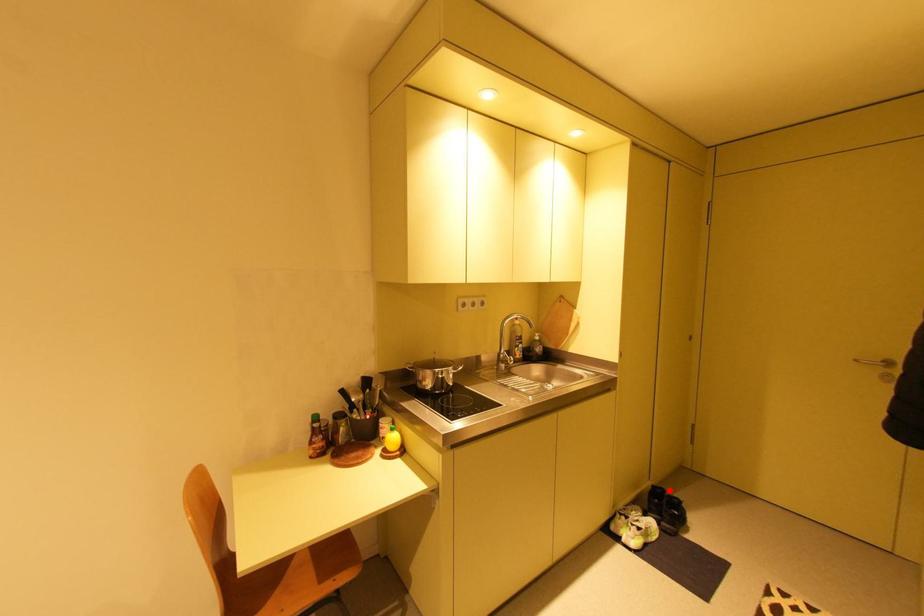
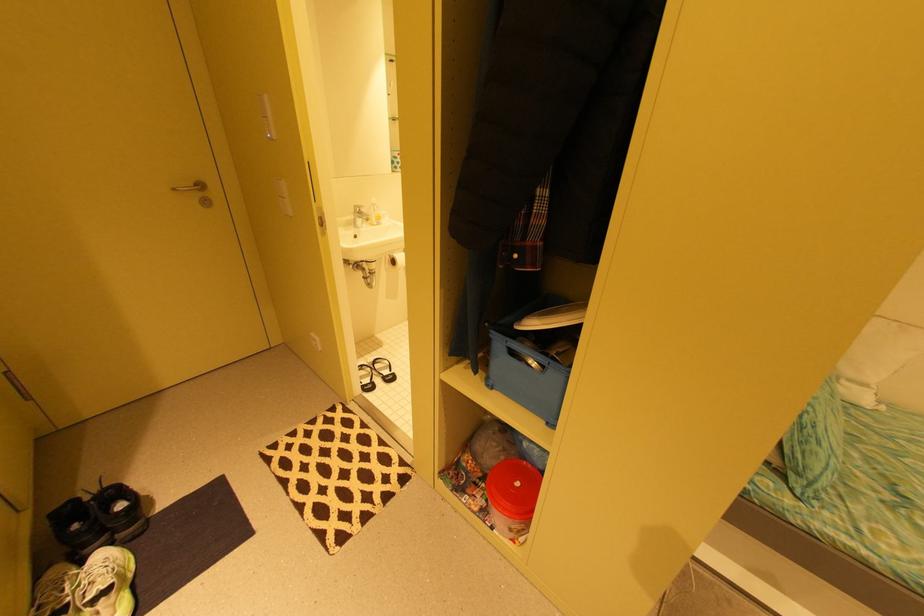
Question: I am providing you with two images of the same scene from different viewpoints. In image1, a red point is highlighted. Considering the same 3D point in image2, which of the following is correct?

Choices:
 (A) It is closer
 (B) It is farther

Answer: (A)